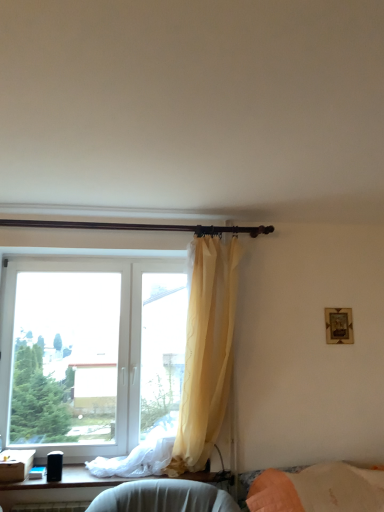
Question: Is white plastic window at left facing away from dark brown wooden curtain rod at upper center?

Choices:
 (A) yes
 (B) no

Answer: (B)

Question: Is white plastic window at left bigger than dark brown wooden curtain rod at upper center?

Choices:
 (A) no
 (B) yes

Answer: (B)

Question: Considering the relative positions of white plastic window at left and dark brown wooden curtain rod at upper center in the image provided, is white plastic window at left to the left of dark brown wooden curtain rod at upper center from the viewer's perspective?

Choices:
 (A) no
 (B) yes

Answer: (B)

Question: Is the depth of white plastic window at left less than that of dark brown wooden curtain rod at upper center?

Choices:
 (A) no
 (B) yes

Answer: (A)

Question: Does white plastic window at left have a lesser width compared to dark brown wooden curtain rod at upper center?

Choices:
 (A) yes
 (B) no

Answer: (A)

Question: From a real-world perspective, is white plastic window at left on dark brown wooden curtain rod at upper center?

Choices:
 (A) no
 (B) yes

Answer: (A)

Question: Is white plastic window at left located within dark brown wooden curtain rod at upper center?

Choices:
 (A) yes
 (B) no

Answer: (B)

Question: From a real-world perspective, does dark brown wooden curtain rod at upper center stand above white plastic window at left?

Choices:
 (A) no
 (B) yes

Answer: (B)

Question: Considering the relative positions of dark brown wooden curtain rod at upper center and white plastic window at left in the image provided, is dark brown wooden curtain rod at upper center in front of white plastic window at left?

Choices:
 (A) no
 (B) yes

Answer: (B)

Question: Is dark brown wooden curtain rod at upper center touching white plastic window at left?

Choices:
 (A) no
 (B) yes

Answer: (A)

Question: Considering the relative sizes of dark brown wooden curtain rod at upper center and white plastic window at left in the image provided, is dark brown wooden curtain rod at upper center shorter than white plastic window at left?

Choices:
 (A) yes
 (B) no

Answer: (A)

Question: Is dark brown wooden curtain rod at upper center at the right side of white plastic window at left?

Choices:
 (A) no
 (B) yes

Answer: (B)

Question: From a real-world perspective, is translucent yellow curtain at upper center over white plastic window at left?

Choices:
 (A) no
 (B) yes

Answer: (B)